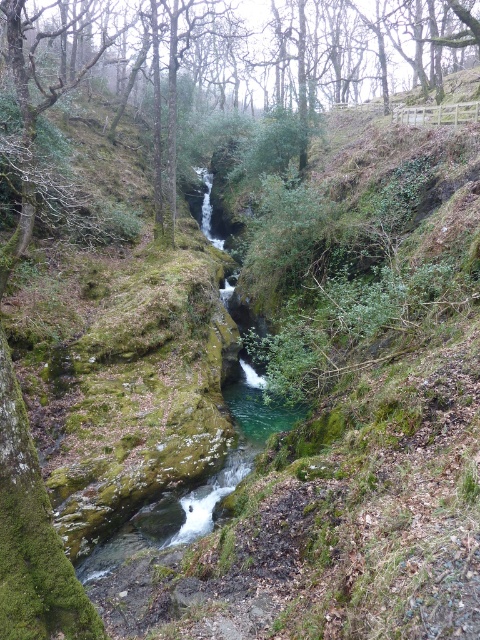
Question: Does green mossy tree at center appear on the left side of clear water at center?

Choices:
 (A) no
 (B) yes

Answer: (A)

Question: Is green mossy tree at center further to camera compared to clear water at center?

Choices:
 (A) no
 (B) yes

Answer: (A)

Question: Can you confirm if green mossy tree at center is thinner than clear water at center?

Choices:
 (A) no
 (B) yes

Answer: (A)